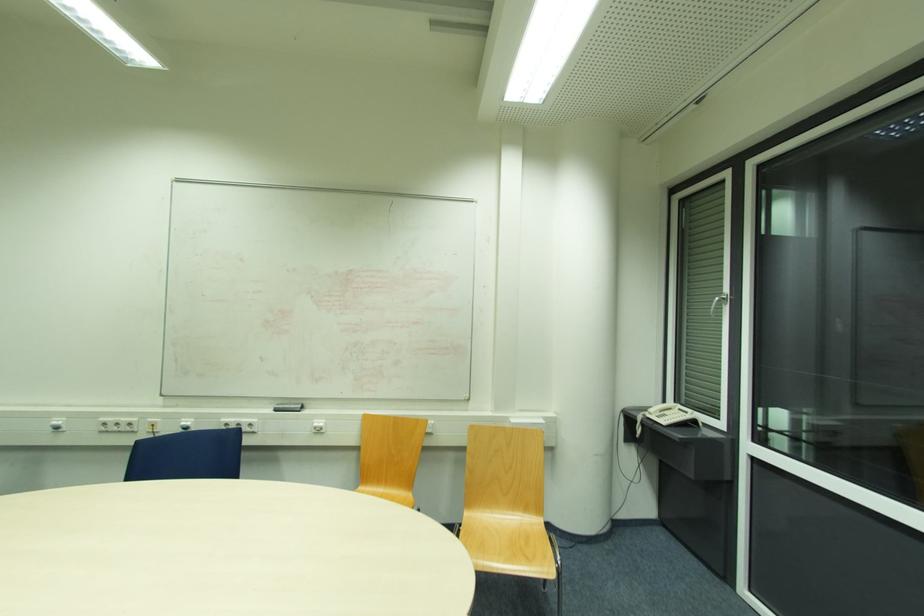
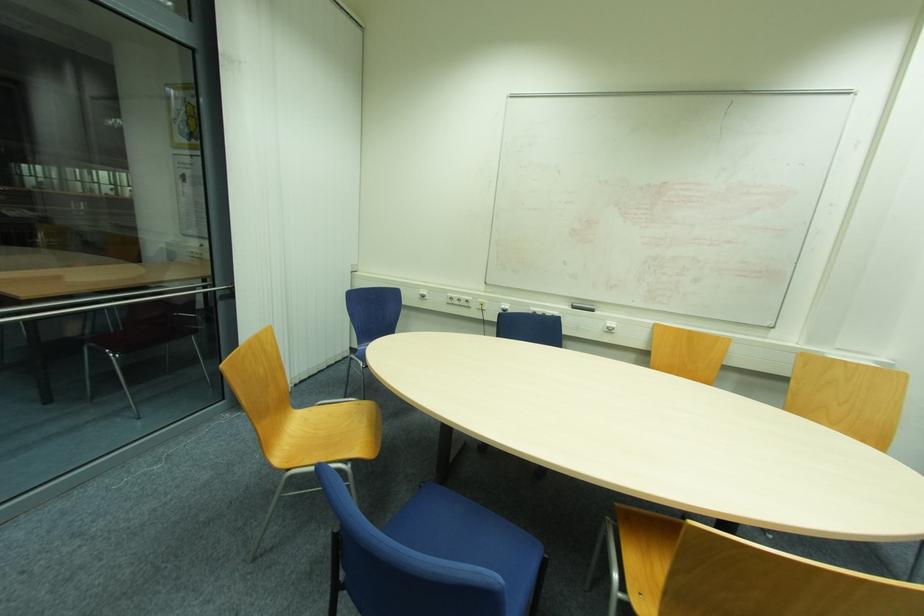
In a continuous first-person perspective shot, in which direction is the camera moving?

The cameraman moved toward left, backward.